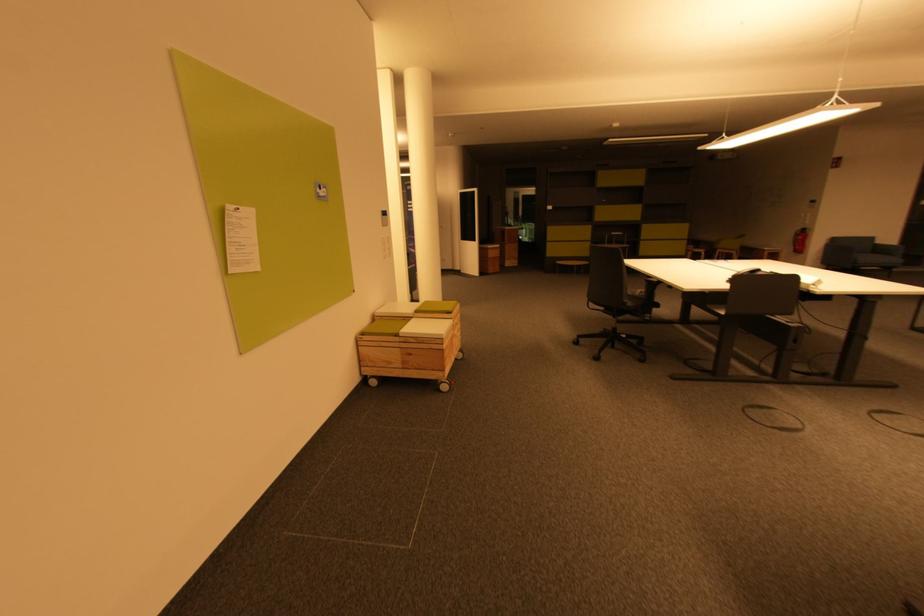
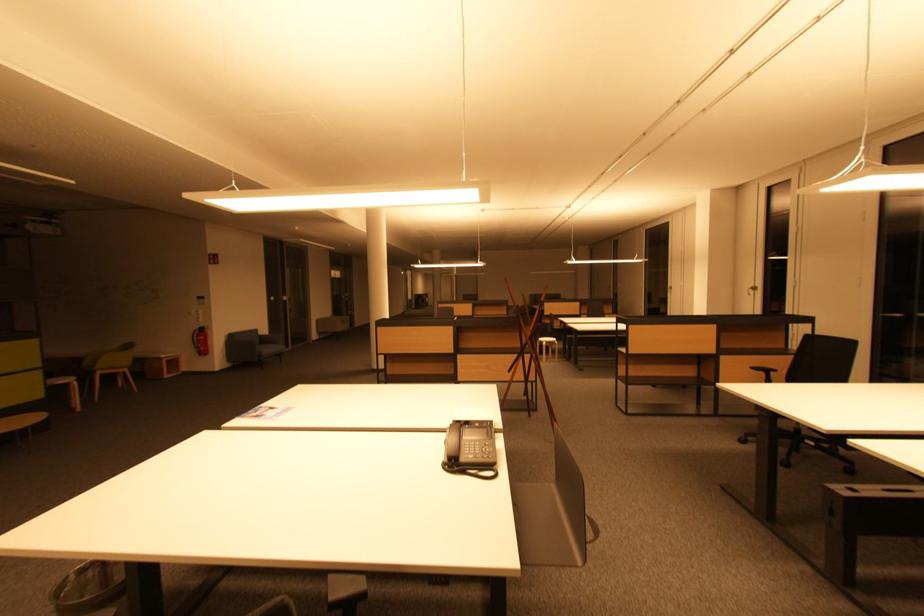
The point at (871, 262) is marked in the first image. Where is the corresponding point in the second image?

(272, 352)